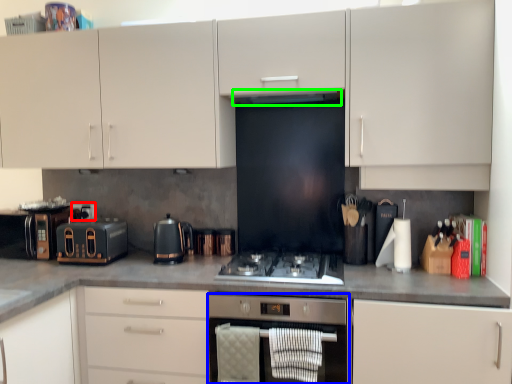
Question: Which is nearer to the appliance (highlighted by a red box)? home appliance (highlighted by a blue box) or exhaust hood (highlighted by a green box).

Choices:
 (A) home appliance
 (B) exhaust hood

Answer: (B)